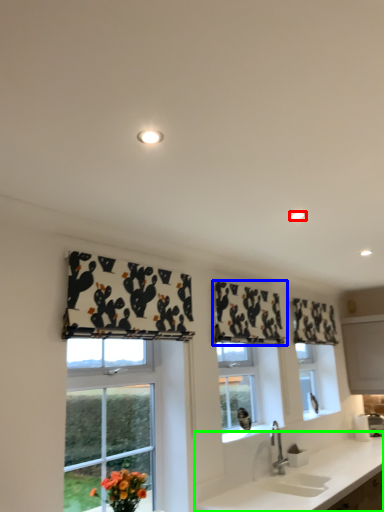
Question: Estimate the real-world distances between objects in this image. Which object is farther from lighting (highlighted by a red box), curtain (highlighted by a blue box) or countertop (highlighted by a green box)?

Choices:
 (A) curtain
 (B) countertop

Answer: (B)